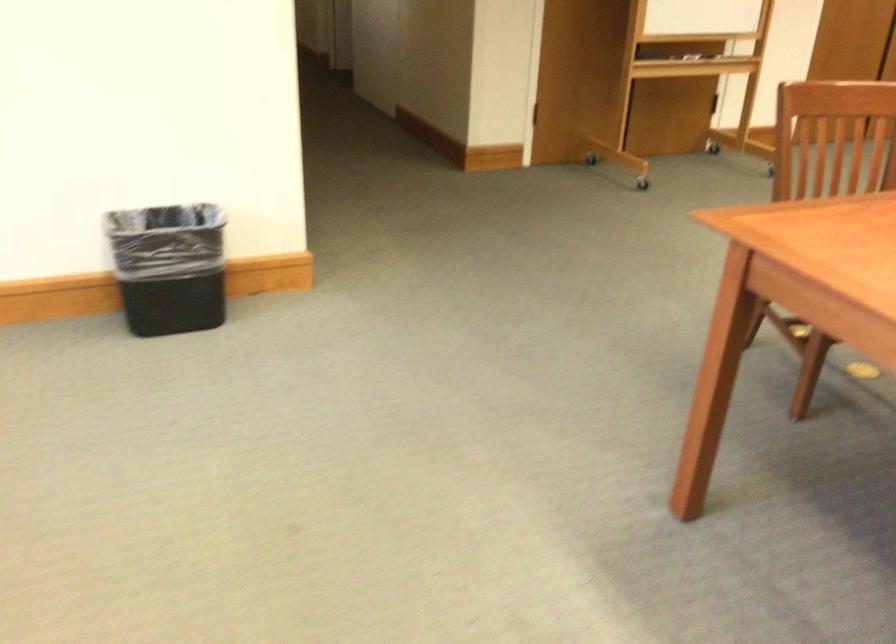
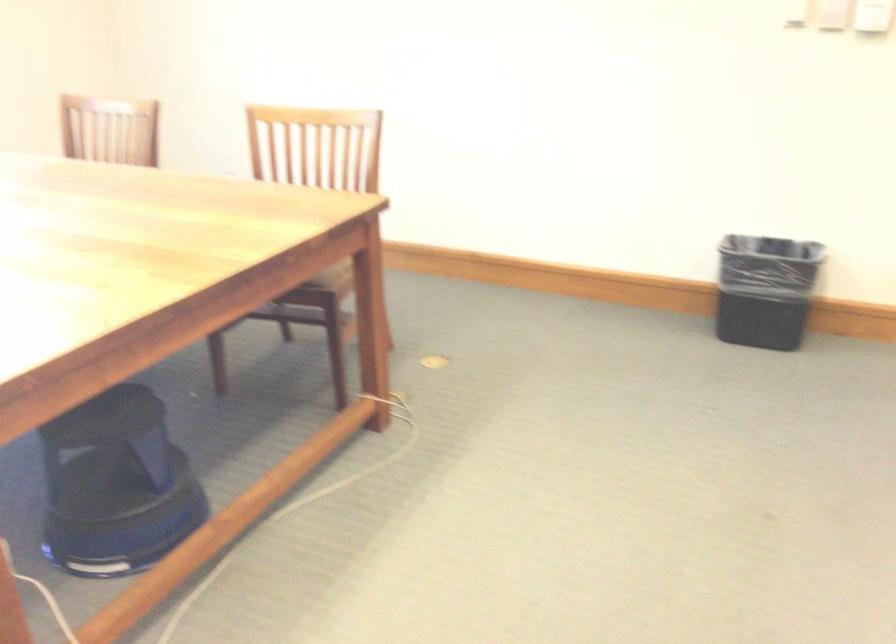
Question: The camera is either moving clockwise (left) or counter-clockwise (right) around the object. The first image is from the beginning of the video and the second image is from the end. Is the camera moving left or right when shooting the video?

Choices:
 (A) Left
 (B) Right

Answer: (B)